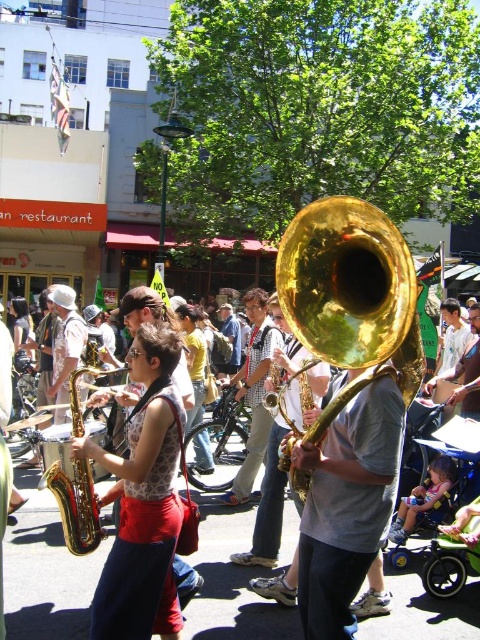
Is matte gold saxophone at center to the right of shiny gold saxophone at center from the viewer's perspective?

No, matte gold saxophone at center is not to the right of shiny gold saxophone at center.

Does matte gold saxophone at center appear on the left side of shiny gold saxophone at center?

Yes, matte gold saxophone at center is to the left of shiny gold saxophone at center.

Identify the location of matte gold saxophone at center. This screenshot has height=640, width=480. (143, 500).

Is gold shiny tuba at center bigger than shiny gold saxophone at center?

No, gold shiny tuba at center is not bigger than shiny gold saxophone at center.

Is point (336, 321) closer to camera compared to point (254, 337)?

Yes, point (336, 321) is in front of point (254, 337).

Between point (295, 292) and point (269, 323), which one is positioned behind?

Positioned behind is point (269, 323).

Locate an element on the screen. The image size is (480, 640). gold shiny tuba at center is located at coordinates (346, 282).

Who is more forward, [176,636] or [389,237]?

Point [389,237] is in front.

Between matte gold saxophone at center and gold shiny tuba at center, which one is positioned lower?

matte gold saxophone at center is below.

At what (x,y) coordinates should I click in order to perform the action: click on matte gold saxophone at center. Please return your answer as a coordinate pair (x, y). The width and height of the screenshot is (480, 640). Looking at the image, I should click on (143, 500).

This screenshot has height=640, width=480. What are the coordinates of `matte gold saxophone at center` in the screenshot? It's located at (143, 500).